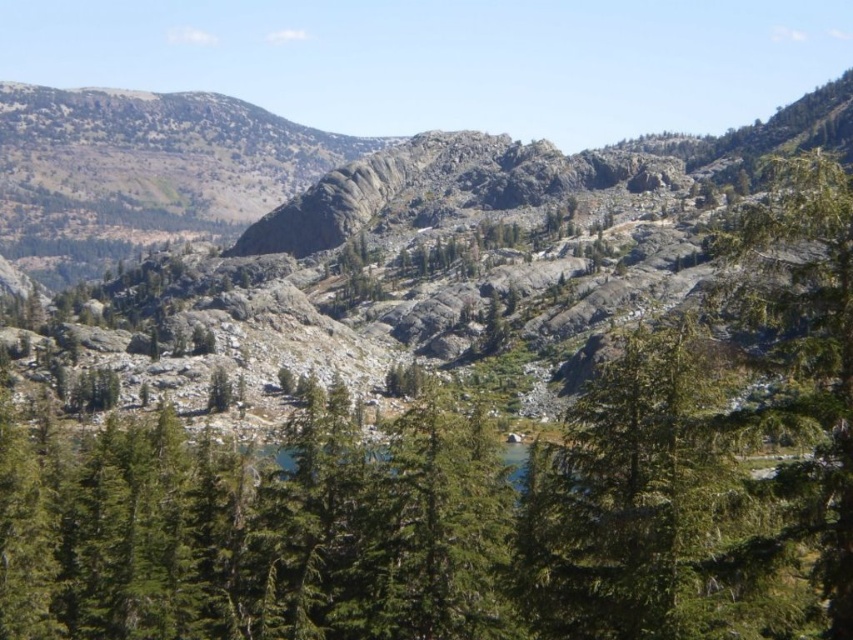
Is gray rocky mountain at center positioned behind green textured tree at right?

That is True.

From the picture: Can you confirm if gray rocky mountain at center is wider than green textured tree at right?

Yes, gray rocky mountain at center is wider than green textured tree at right.

This screenshot has width=853, height=640. In order to click on gray rocky mountain at center in this screenshot , I will do `click(312, 173)`.

The width and height of the screenshot is (853, 640). Find the location of `gray rocky mountain at center`. gray rocky mountain at center is located at coordinates (312, 173).